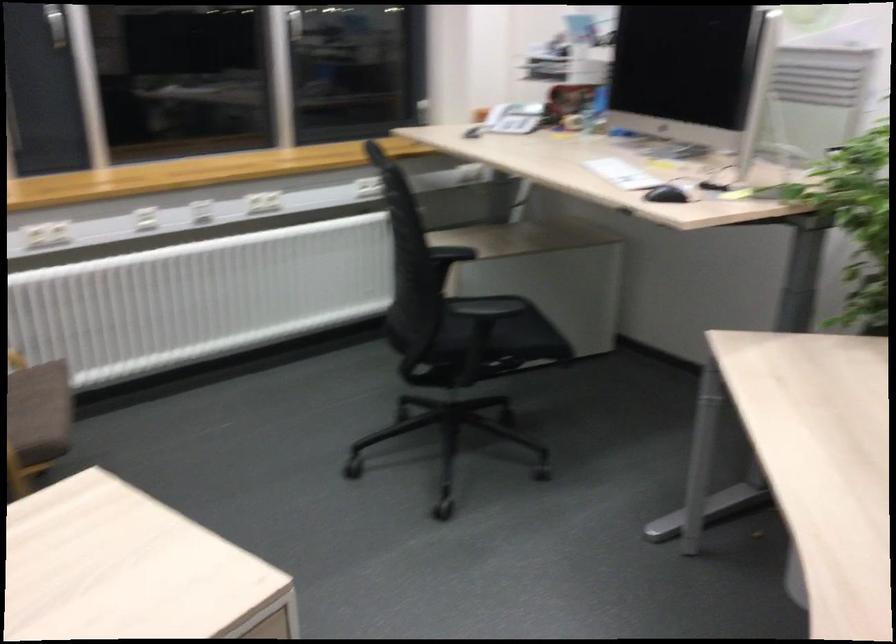
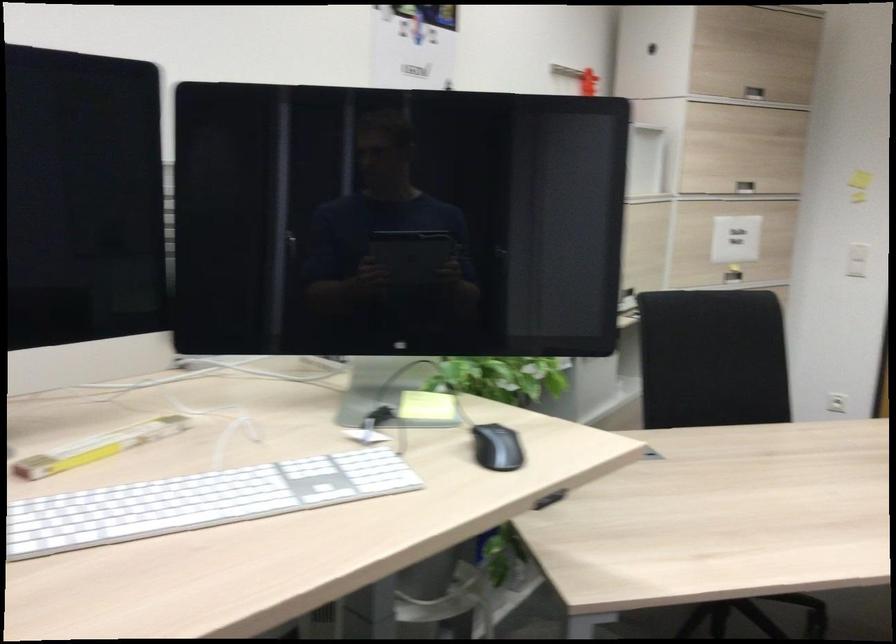
Where in the second image is the point corresponding to [685,161] from the first image?

(98, 447)